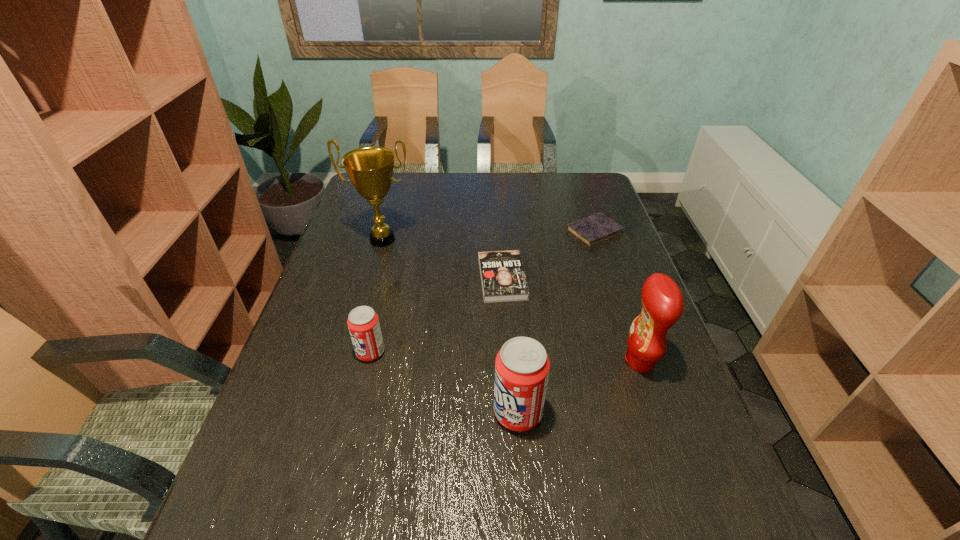
Identify the location of the fourth tallest object. point(363,323).

Identify the location of the farther soda can. This screenshot has height=540, width=960. (363, 323).

Locate an element on the screen. This screenshot has height=540, width=960. the taller soda can is located at coordinates (522, 366).

Where is `the nearer soda can`? This screenshot has height=540, width=960. the nearer soda can is located at coordinates (522, 366).

Locate an element on the screen. This screenshot has height=540, width=960. diary is located at coordinates (592, 230).

Image resolution: width=960 pixels, height=540 pixels. In order to click on book in this screenshot , I will do `click(503, 279)`.

Locate an element on the screen. the third farthest object is located at coordinates (503, 279).

Where is `the tallest object`? The image size is (960, 540). the tallest object is located at coordinates (370, 169).

You are a GUI agent. You are given a task and a screenshot of the screen. Output one action in this format:
    pyautogui.click(x=<x>, y=<y>)
    Task: Click on the condiment
    
    Given the screenshot: What is the action you would take?
    pyautogui.click(x=662, y=303)

Locate an element on the screen. vacant region located on the surface of the shorter soda can is located at coordinates (307, 352).